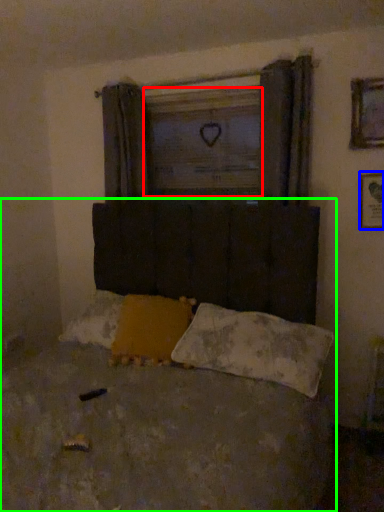
Question: Estimate the real-world distances between objects in this image. Which object is closer to window screen (highlighted by a red box), picture frame (highlighted by a blue box) or bed (highlighted by a green box)?

Choices:
 (A) picture frame
 (B) bed

Answer: (A)